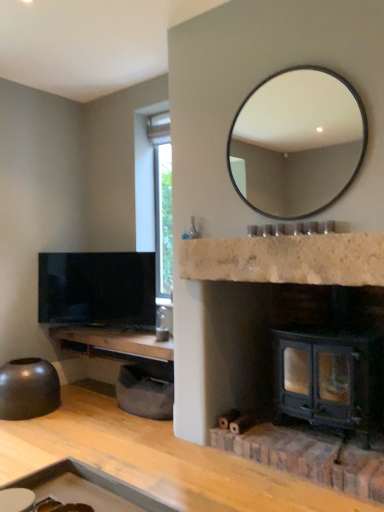
Question: Can matte black bowl at lower left be found inside matte black mirror at upper center?

Choices:
 (A) no
 (B) yes

Answer: (A)

Question: Is matte black mirror at upper center at the right side of matte black bowl at lower left?

Choices:
 (A) no
 (B) yes

Answer: (B)

Question: Does matte black mirror at upper center have a greater width compared to matte black bowl at lower left?

Choices:
 (A) yes
 (B) no

Answer: (B)

Question: Is matte black mirror at upper center far away from matte black bowl at lower left?

Choices:
 (A) yes
 (B) no

Answer: (A)

Question: Considering the relative positions of matte black mirror at upper center and matte black bowl at lower left in the image provided, is matte black mirror at upper center behind matte black bowl at lower left?

Choices:
 (A) yes
 (B) no

Answer: (B)

Question: Considering their positions, is matte black bowl at lower left located in front of or behind woodenmaterial/texturecounter top at left, the first counter top from the left?

Choices:
 (A) front
 (B) behind

Answer: (B)

Question: Considering the positions of matte black bowl at lower left and woodenmaterial/texturecounter top at left, which is the 2th counter top from top to bottom, in the image, is matte black bowl at lower left taller or shorter than woodenmaterial/texturecounter top at left, which is the 2th counter top from top to bottom,?

Choices:
 (A) tall
 (B) short

Answer: (A)

Question: Is matte black bowl at lower left wider or thinner than woodenmaterial/texturecounter top at left, which is the second counter top from right to left?

Choices:
 (A) wide
 (B) thin

Answer: (A)

Question: In terms of size, does matte black bowl at lower left appear bigger or smaller than woodenmaterial/texturecounter top at left, the first counter top from the left?

Choices:
 (A) big
 (B) small

Answer: (B)

Question: From the image's perspective, is dark green metal wood burning stove at lower right above or below matte black bowl at lower left?

Choices:
 (A) below
 (B) above

Answer: (B)

Question: From a real-world perspective, is dark green metal wood burning stove at lower right physically located above or below matte black bowl at lower left?

Choices:
 (A) below
 (B) above

Answer: (B)

Question: Based on their sizes in the image, would you say dark green metal wood burning stove at lower right is bigger or smaller than matte black bowl at lower left?

Choices:
 (A) small
 (B) big

Answer: (B)

Question: Is dark green metal wood burning stove at lower right to the left or to the right of matte black bowl at lower left in the image?

Choices:
 (A) left
 (B) right

Answer: (B)

Question: In terms of size, does matte black tv at left appear bigger or smaller than matte black mirror at upper center?

Choices:
 (A) big
 (B) small

Answer: (A)

Question: Would you say matte black tv at left is to the left or to the right of matte black mirror at upper center in the picture?

Choices:
 (A) right
 (B) left

Answer: (B)